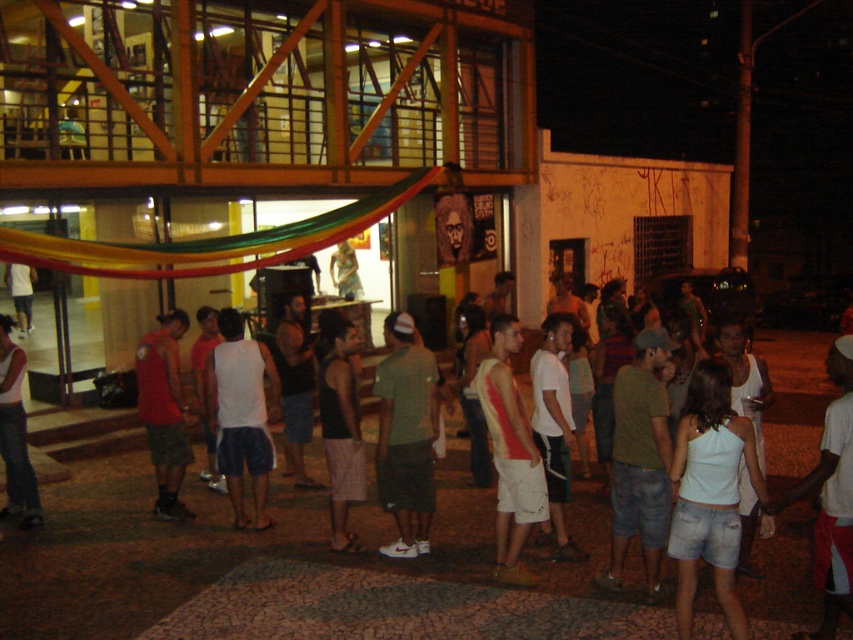
Question: Among these objects, which one is farthest from the camera?

Choices:
 (A) white matte tank top at center
 (B) black fabric tank top at center

Answer: (A)

Question: Can you confirm if reddish-orange sleeveless shirt at center is positioned below white tank top at lower left?

Choices:
 (A) no
 (B) yes

Answer: (B)

Question: Among these objects, which one is farthest from the camera?

Choices:
 (A) green cotton shirt at center
 (B) white matte tank top at center
 (C) matte red tank top at center

Answer: (C)

Question: Does white matte tank top at center have a smaller size compared to black fabric tank top at center?

Choices:
 (A) no
 (B) yes

Answer: (A)

Question: Is white cotton tank top at center wider than green cotton shirt at center?

Choices:
 (A) no
 (B) yes

Answer: (B)

Question: Which object is closer to the camera taking this photo?

Choices:
 (A) white cotton tank top at center
 (B) white matte tank top at center
 (C) matte red tank top at center

Answer: (A)